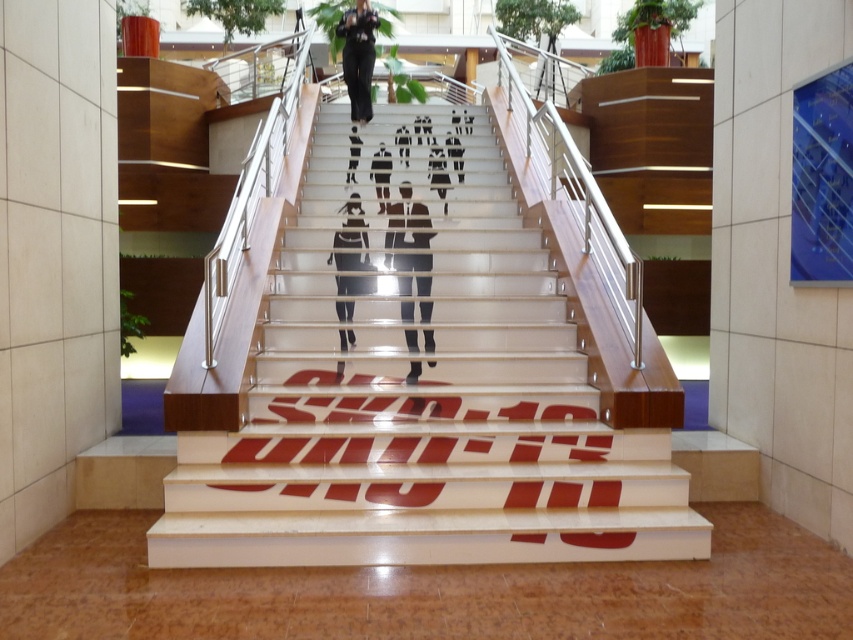
Question: Which point is farther to the camera?

Choices:
 (A) matte black figure at center
 (B) black fabric pants at center
 (C) white glossy stairs at center
 (D) black glossy pants at center

Answer: (B)

Question: Among these objects, which one is nearest to the camera?

Choices:
 (A) matte black figure at center
 (B) black fabric pants at center
 (C) white glossy stairs at center
 (D) black glossy pants at center

Answer: (C)

Question: Can you confirm if white glossy stairs at center is smaller than black glossy pants at center?

Choices:
 (A) no
 (B) yes

Answer: (A)

Question: Does matte black figure at center appear on the right side of black glossy pants at center?

Choices:
 (A) yes
 (B) no

Answer: (A)

Question: Which object is closer to the camera taking this photo?

Choices:
 (A) black glossy pants at center
 (B) matte black figure at center
 (C) black fabric pants at center

Answer: (B)

Question: Is matte black figure at center above black fabric pants at center?

Choices:
 (A) yes
 (B) no

Answer: (B)